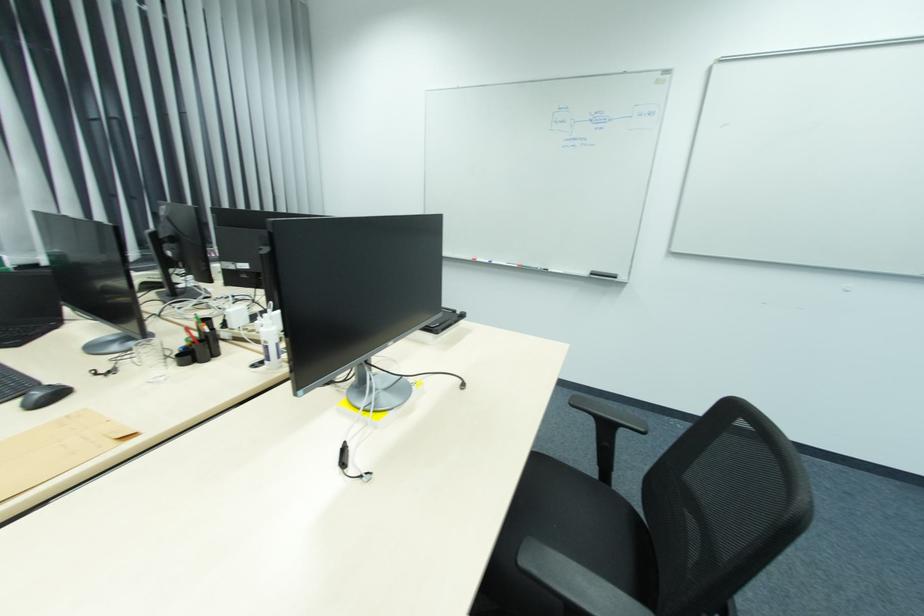
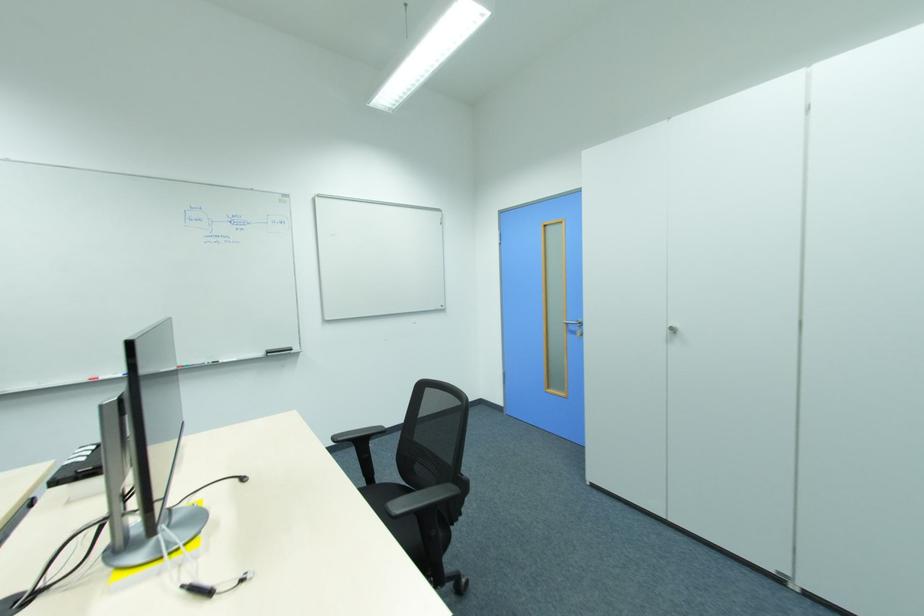
Question: The camera is either moving clockwise (left) or counter-clockwise (right) around the object. The first image is from the beginning of the video and the second image is from the end. Is the camera moving left or right when shooting the video?

Choices:
 (A) Left
 (B) Right

Answer: (A)